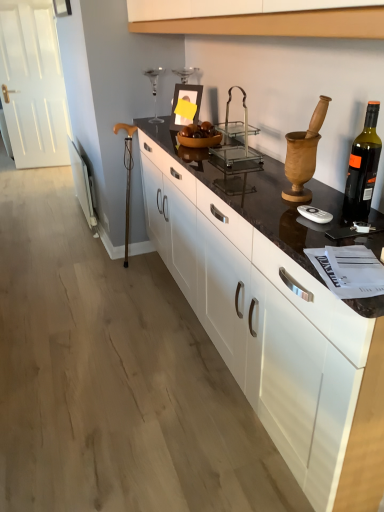
Question: Can you confirm if clear glass trolley at center is smaller than black glass bottle at right?

Choices:
 (A) no
 (B) yes

Answer: (A)

Question: From a real-world perspective, is clear glass trolley at center physically above black glass bottle at right?

Choices:
 (A) yes
 (B) no

Answer: (B)

Question: Is clear glass trolley at center wider than black glass bottle at right?

Choices:
 (A) yes
 (B) no

Answer: (A)

Question: Is clear glass trolley at center shorter than black glass bottle at right?

Choices:
 (A) yes
 (B) no

Answer: (A)

Question: Is clear glass trolley at center further to camera compared to black glass bottle at right?

Choices:
 (A) no
 (B) yes

Answer: (B)

Question: Is the depth of clear glass trolley at center less than that of black glass bottle at right?

Choices:
 (A) yes
 (B) no

Answer: (B)

Question: Considering the relative positions of black glass bottle at right and clear glass trolley at center in the image provided, is black glass bottle at right behind clear glass trolley at center?

Choices:
 (A) no
 (B) yes

Answer: (A)

Question: Does black glass bottle at right have a greater height compared to clear glass trolley at center?

Choices:
 (A) no
 (B) yes

Answer: (B)

Question: Does black glass bottle at right have a smaller size compared to clear glass trolley at center?

Choices:
 (A) yes
 (B) no

Answer: (A)

Question: Does black glass bottle at right appear on the right side of clear glass trolley at center?

Choices:
 (A) no
 (B) yes

Answer: (B)

Question: From a real-world perspective, is black glass bottle at right over clear glass trolley at center?

Choices:
 (A) yes
 (B) no

Answer: (A)

Question: Is black glass bottle at right at the left side of clear glass trolley at center?

Choices:
 (A) no
 (B) yes

Answer: (A)

Question: Can you confirm if black glass bottle at right is positioned to the right of black marble countertop at center?

Choices:
 (A) yes
 (B) no

Answer: (A)